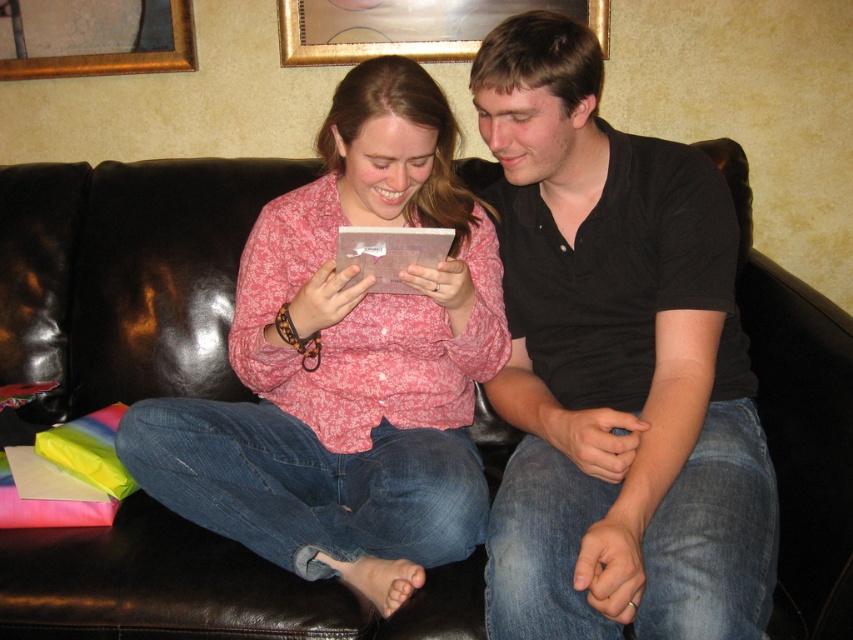
Question: In this image, where is black cotton shirt at center located relative to pink floral shirt at center?

Choices:
 (A) left
 (B) right

Answer: (B)

Question: Does black cotton shirt at center lie behind pink floral shirt at center?

Choices:
 (A) no
 (B) yes

Answer: (A)

Question: In this image, where is black cotton shirt at center located relative to pink floral shirt at center?

Choices:
 (A) left
 (B) right

Answer: (B)